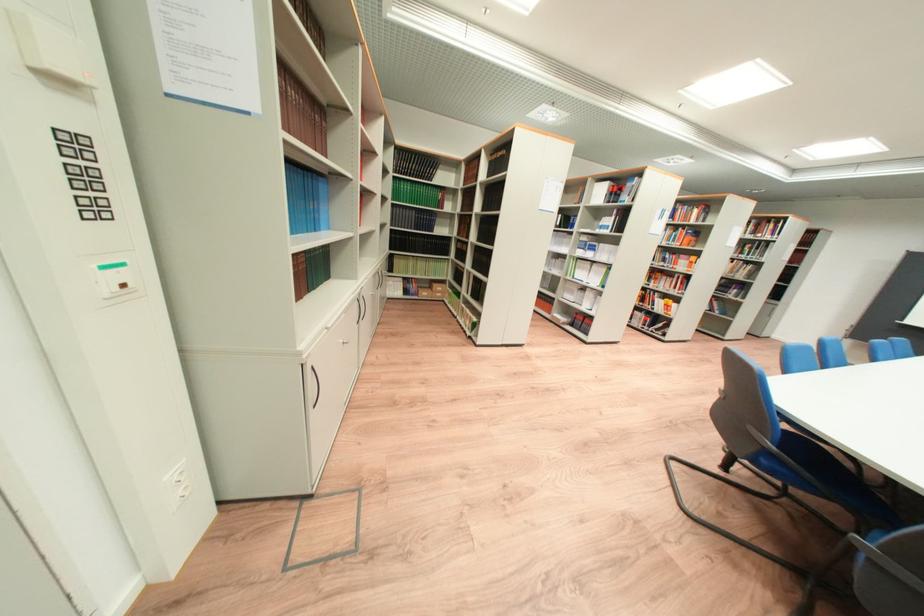
The width and height of the screenshot is (924, 616). What do you see at coordinates (805, 446) in the screenshot? I see `a blue chair sitting surface` at bounding box center [805, 446].